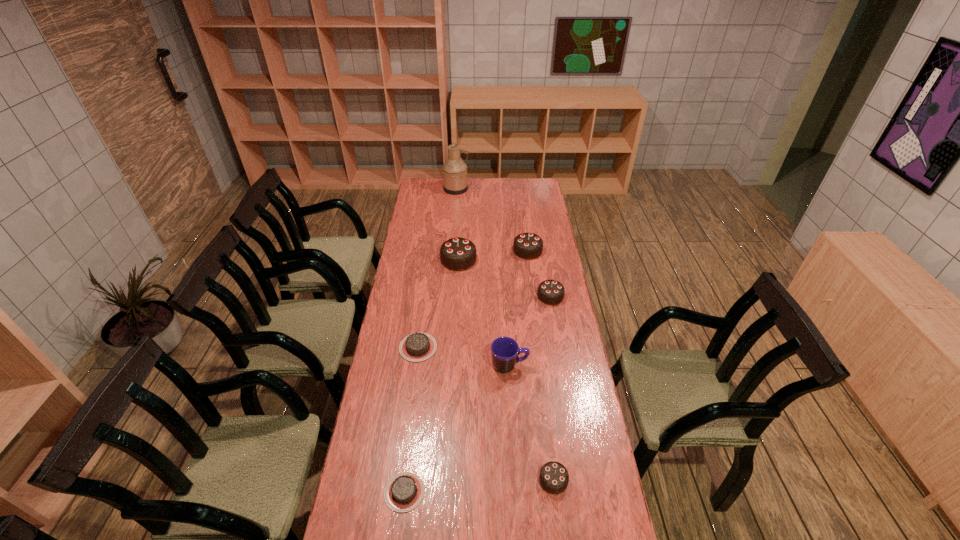
The height and width of the screenshot is (540, 960). In order to click on vacant area that lies between the fourth shortest chocolate cake and the biggest chocolate chocolate cake in this screenshot , I will do `click(504, 278)`.

The image size is (960, 540). I want to click on free area in between the fifth tallest object and the leftmost chocolate chocolate cake, so click(504, 278).

What are the coordinates of `free point between the shortest chocolate cake and the second biggest chocolate chocolate cake` in the screenshot? It's located at (467, 372).

This screenshot has height=540, width=960. In order to click on empty location between the third shortest chocolate cake and the fifth nearest object in this screenshot , I will do `click(552, 388)`.

Find the location of a particular element. blank region between the third smallest chocolate chocolate cake and the mug is located at coordinates (518, 308).

Locate an element on the screen. The image size is (960, 540). object that is the fourth closest to the mug is located at coordinates (404, 491).

You are a GUI agent. You are given a task and a screenshot of the screen. Output one action in this format:
    pyautogui.click(x=<x>, y=<y>)
    Task: Click on the object that stands as the fourth closest to the leftmost chocolate chocolate cake
    This screenshot has width=960, height=540.
    Given the screenshot: What is the action you would take?
    pyautogui.click(x=505, y=351)

Identify the location of chocolate cake that is the third closest to the smaller brown chocolate cake. This screenshot has width=960, height=540. (551, 292).

Locate an element on the screen. Image resolution: width=960 pixels, height=540 pixels. chocolate cake that is the third closest to the leftmost chocolate chocolate cake is located at coordinates (416, 347).

Where is `chocolate chocolate cake that is the fourth closest to the second shortest chocolate cake`? This screenshot has height=540, width=960. chocolate chocolate cake that is the fourth closest to the second shortest chocolate cake is located at coordinates (528, 246).